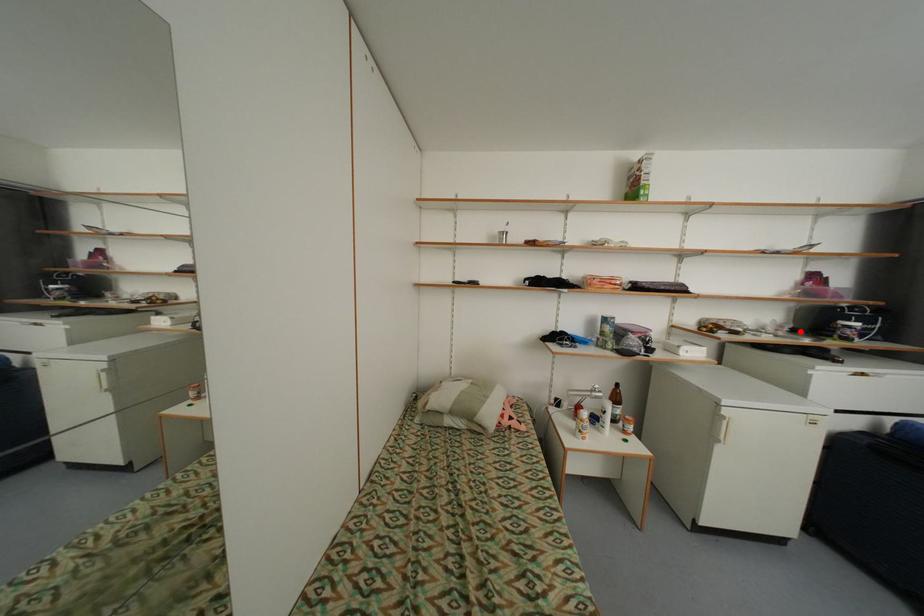
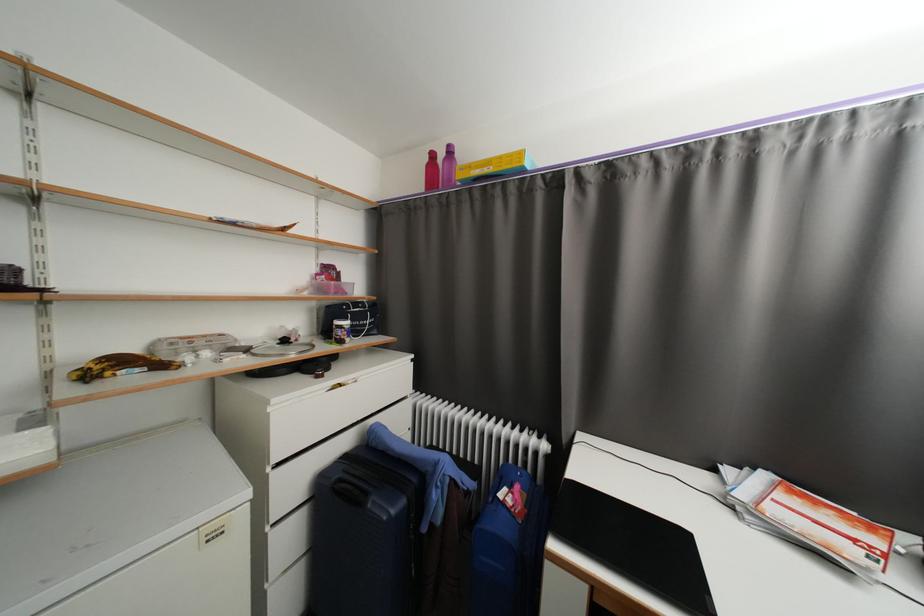
Find the pixel in the second image that matches the highlighted location in the first image.

(290, 342)